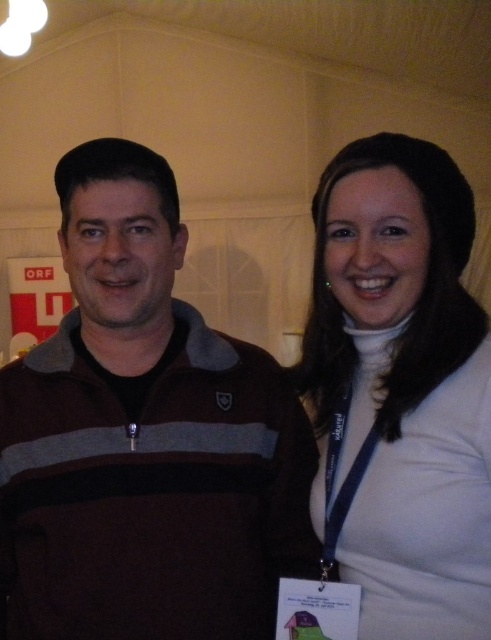
Between point (187, 378) and point (405, 618), which one is positioned behind?

Positioned behind is point (187, 378).

Who is shorter, brown fleece at left or white matte turtleneck at upper right?

Standing shorter between the two is white matte turtleneck at upper right.

Which is in front, point (236, 605) or point (370, 179)?

Point (370, 179) is more forward.

Locate an element on the screen. brown fleece at left is located at coordinates (144, 438).